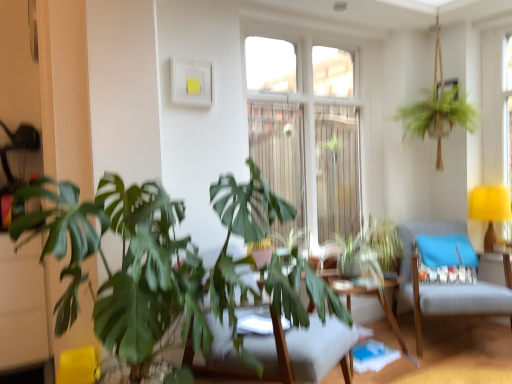
Question: Should I look upward or downward to see clear glass window at center?

Choices:
 (A) up
 (B) down

Answer: (A)

Question: Considering the relative positions of wooden table at center and yellow fabric lampshade at right in the image provided, is wooden table at center behind yellow fabric lampshade at right?

Choices:
 (A) yes
 (B) no

Answer: (B)

Question: From the image's perspective, does wooden table at center appear lower than yellow fabric lampshade at right?

Choices:
 (A) yes
 (B) no

Answer: (A)

Question: Can you confirm if wooden table at center is positioned to the right of yellow fabric lampshade at right?

Choices:
 (A) no
 (B) yes

Answer: (A)

Question: Is wooden table at center facing towards yellow fabric lampshade at right?

Choices:
 (A) no
 (B) yes

Answer: (A)

Question: Would you say wooden table at center is outside yellow fabric lampshade at right?

Choices:
 (A) no
 (B) yes

Answer: (B)

Question: Can you confirm if wooden table at center is thinner than yellow fabric lampshade at right?

Choices:
 (A) no
 (B) yes

Answer: (A)

Question: Is clear glass window at center taller than green leafy plant at center?

Choices:
 (A) yes
 (B) no

Answer: (A)

Question: From the image's perspective, does clear glass window at center appear higher than green leafy plant at center?

Choices:
 (A) yes
 (B) no

Answer: (A)

Question: Can you confirm if clear glass window at center is bigger than green leafy plant at center?

Choices:
 (A) yes
 (B) no

Answer: (B)

Question: Is the position of clear glass window at center less distant than that of green leafy plant at center?

Choices:
 (A) yes
 (B) no

Answer: (B)

Question: Is clear glass window at center not near green leafy plant at center?

Choices:
 (A) yes
 (B) no

Answer: (A)

Question: Is the surface of clear glass window at center in direct contact with green leafy plant at center?

Choices:
 (A) yes
 (B) no

Answer: (B)

Question: Can you confirm if blue fabric pillow at right is taller than wooden swivel chair at center, acting as the 1th swivel chair starting from the left?

Choices:
 (A) yes
 (B) no

Answer: (B)